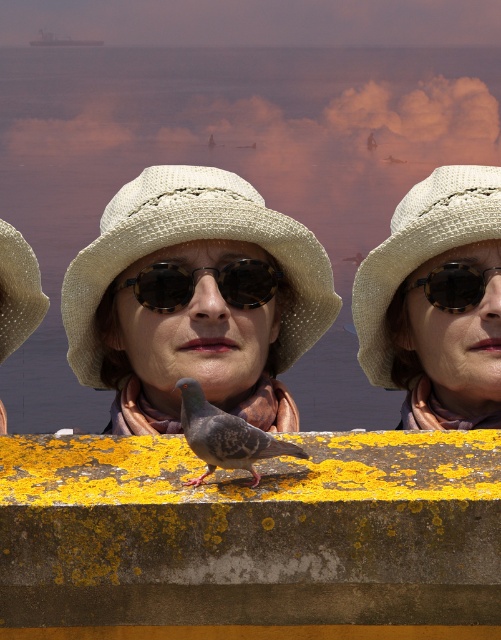
Question: Which point is farther to the camera?

Choices:
 (A) (189, 180)
 (B) (197, 381)

Answer: (A)

Question: Can you confirm if natural straw hat at center is positioned above tortoiseshell sunglasses at center?

Choices:
 (A) no
 (B) yes

Answer: (B)

Question: Is gray speckled pigeon at center wider than tortoiseshell sunglasses at center?

Choices:
 (A) yes
 (B) no

Answer: (B)

Question: Can you confirm if gray speckled pigeon at center is positioned above tortoiseshell sunglasses at center?

Choices:
 (A) no
 (B) yes

Answer: (A)

Question: Which point appears closest to the camera in this image?

Choices:
 (A) (190, 413)
 (B) (159, 291)
 (C) (140, 221)

Answer: (A)

Question: Considering the real-world distances, which object is farthest from the tortoiseshell plastic goggles at center?

Choices:
 (A) natural straw hat at center
 (B) white woven hat at center

Answer: (B)